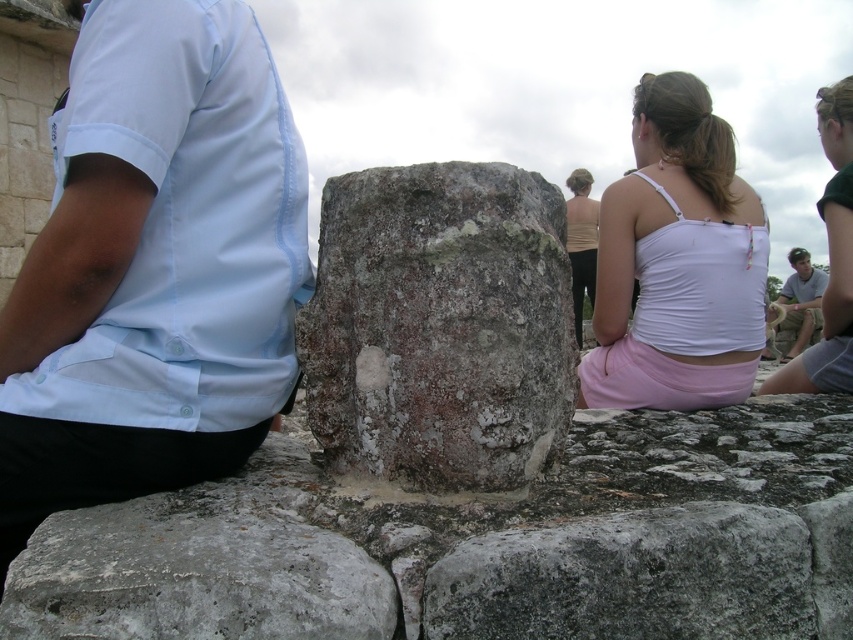
Based on the scene described, where is the gray stone boulder at center located in terms of coordinates?

The gray stone boulder at center is located at coordinates point (630,579).

You are standing in front of the ancient site and want to take a photo of the rusty stone boulder at center without the light blue shirt at right appearing in the frame. Is this possible given their positions?

The rusty stone boulder at center is in front of the light blue shirt at right, so you can take a photo of the rusty stone boulder at center without the light blue shirt at right by positioning yourself so the boulder blocks the view of the shirt.

You are a photographer trying to capture the gray stone boulder at center and the beige fabric top at center in the same frame. Based on their sizes, which object should you focus on first to ensure both are clearly visible in the photo?

The gray stone boulder at center is wider than the beige fabric top at center, so focusing on the gray stone boulder at center first will help ensure both objects are visible in the frame.